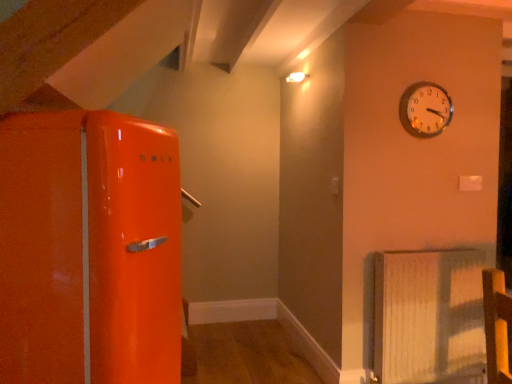
Question: From a real-world perspective, relative to white textured radiator at lower right, is metallic gold clock at upper right vertically above or below?

Choices:
 (A) above
 (B) below

Answer: (A)

Question: Is metallic gold clock at upper right to the left or to the right of white textured radiator at lower right in the image?

Choices:
 (A) left
 (B) right

Answer: (A)

Question: In terms of width, does metallic gold clock at upper right look wider or thinner when compared to white textured radiator at lower right?

Choices:
 (A) wide
 (B) thin

Answer: (B)

Question: Is point (440, 354) closer or farther from the camera than point (431, 109)?

Choices:
 (A) closer
 (B) farther

Answer: (A)

Question: In the image, is white textured radiator at lower right positioned in front of or behind metallic gold clock at upper right?

Choices:
 (A) behind
 (B) front

Answer: (B)

Question: Is white textured radiator at lower right wider or thinner than metallic gold clock at upper right?

Choices:
 (A) thin
 (B) wide

Answer: (B)

Question: Considering the positions of white textured radiator at lower right and metallic gold clock at upper right in the image, is white textured radiator at lower right bigger or smaller than metallic gold clock at upper right?

Choices:
 (A) big
 (B) small

Answer: (A)